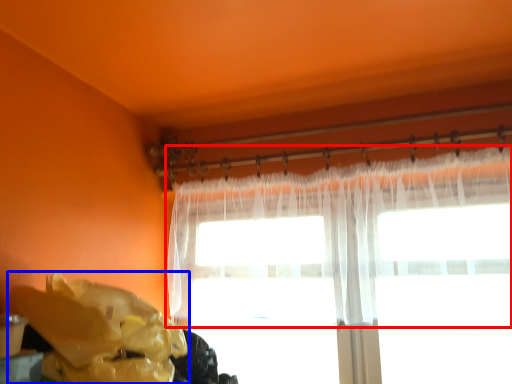
Question: Which object is closer to the camera taking this photo, curtain (highlighted by a red box) or waste (highlighted by a blue box)?

Choices:
 (A) curtain
 (B) waste

Answer: (B)